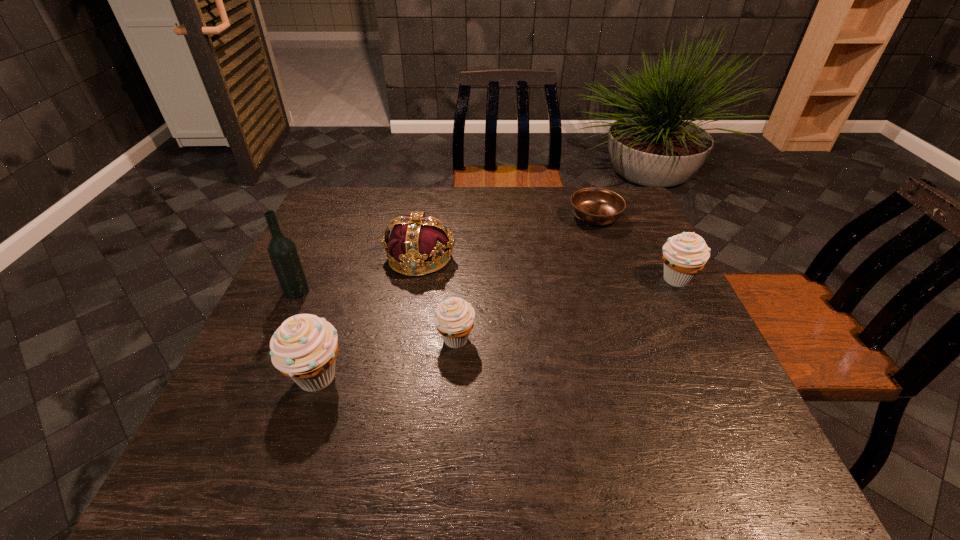
Where is `vacant spot for a new muffin to ensure equal spacing`? This screenshot has height=540, width=960. vacant spot for a new muffin to ensure equal spacing is located at coordinates (573, 307).